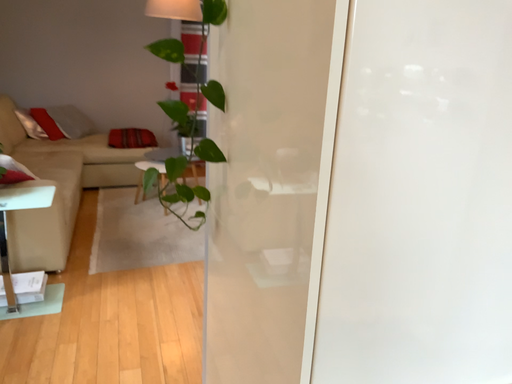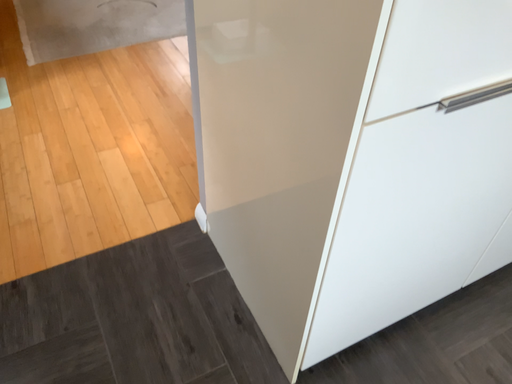
Question: Which way did the camera rotate in the video?

Choices:
 (A) rotated upward
 (B) rotated downward

Answer: (B)